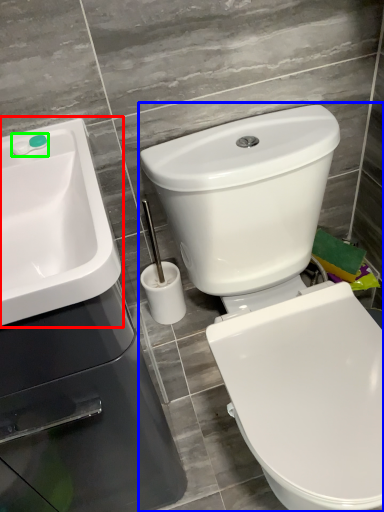
Question: Which object is positioned farthest from sink (highlighted by a red box)? Select from toilet (highlighted by a blue box) and plumbing fixture (highlighted by a green box).

Choices:
 (A) toilet
 (B) plumbing fixture

Answer: (A)